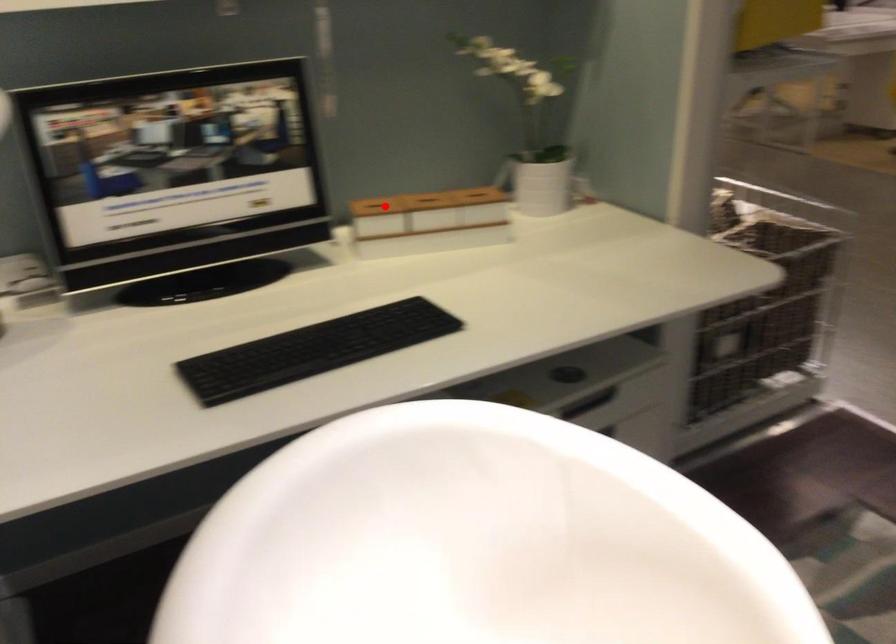
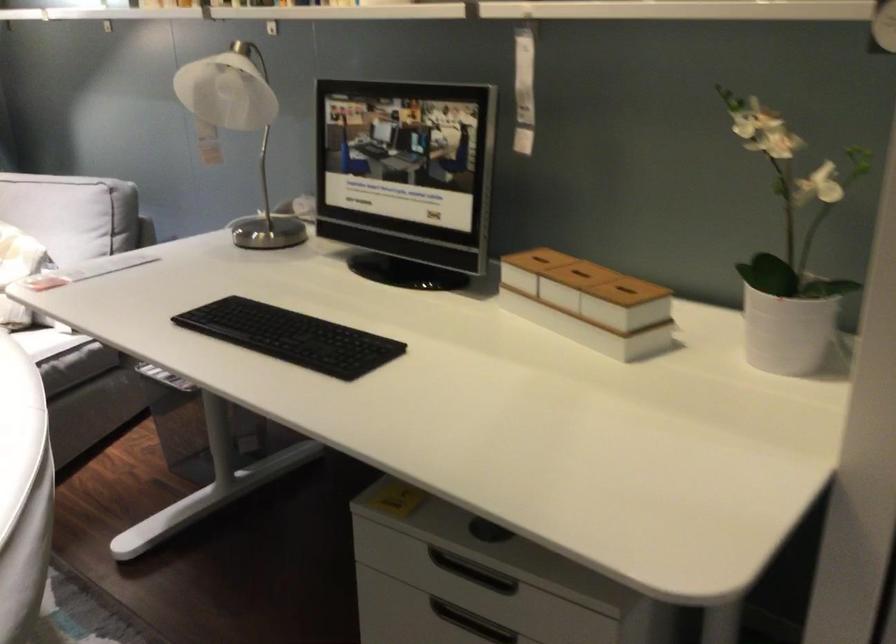
Question: I am providing you with two images of the same scene from different viewpoints. Image1 has a red point marked. In image2, the corresponding 3D location appears at what relative position? Reply with the corresponding letter.

Choices:
 (A) Closer
 (B) Farther

Answer: (A)